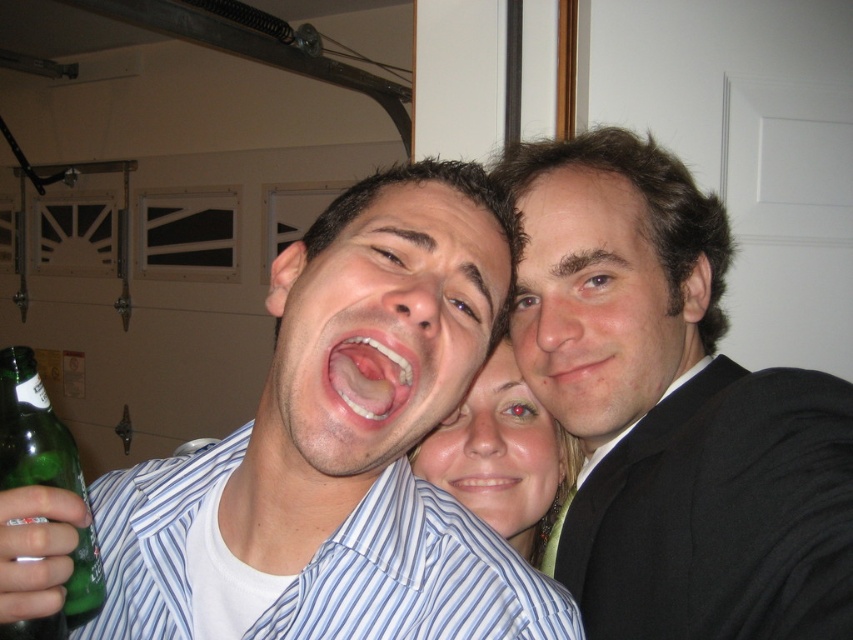
Is smooth black suit at upper right thinner than smooth skin at center?

No.

In the scene shown: Does smooth black suit at upper right appear under smooth skin at center?

Yes, smooth black suit at upper right is below smooth skin at center.

The height and width of the screenshot is (640, 853). In order to click on smooth black suit at upper right in this screenshot , I will do `click(598, 304)`.

Which is below, matte white shirt at center or green glass bottle at lower left?

green glass bottle at lower left is below.

Is point (463, 346) positioned in front of point (74, 564)?

No.

Which is behind, point (323, 260) or point (39, 483)?

The point (323, 260) is more distant.

The height and width of the screenshot is (640, 853). I want to click on matte white shirt at center, so click(x=380, y=328).

Is point (12, 477) in front of point (618, 349)?

Yes, it is in front of point (618, 349).

Which is behind, point (9, 445) or point (587, 273)?

Point (587, 273)

The height and width of the screenshot is (640, 853). Identify the location of green glass bottle at lower left. pyautogui.click(x=32, y=429).